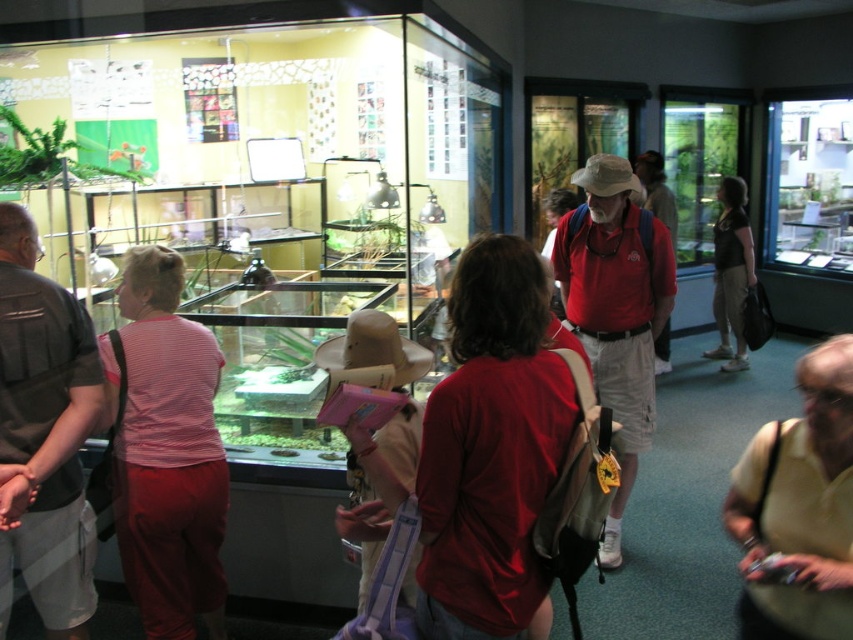
You are standing in the exhibit space and want to take a photo of the pink fabric hat at center without the matte red shirt at center blocking the view. Is this possible?

The pink fabric hat at center is positioned under the matte red shirt at center, so taking a photo of the pink fabric hat at center without the matte red shirt at center blocking the view would require adjusting the angle to look downward since the hat is below the shirt.

You are standing at the center of the exhibit room. Looking towards the large windows on the right, can you see the yellow smooth shirt at lower right from your current position?

Yes, the yellow smooth shirt at lower right is located at point (x=799, y=508), which is within the visible area from the center of the room facing the large windows on the right.